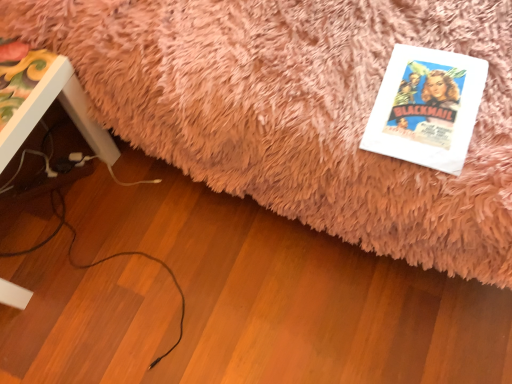
Find the location of `white paper at lower right`. white paper at lower right is located at coordinates (426, 107).

What do you see at coordinates (426, 107) in the screenshot? I see `white paper at lower right` at bounding box center [426, 107].

The width and height of the screenshot is (512, 384). I want to click on white paper at lower right, so click(426, 107).